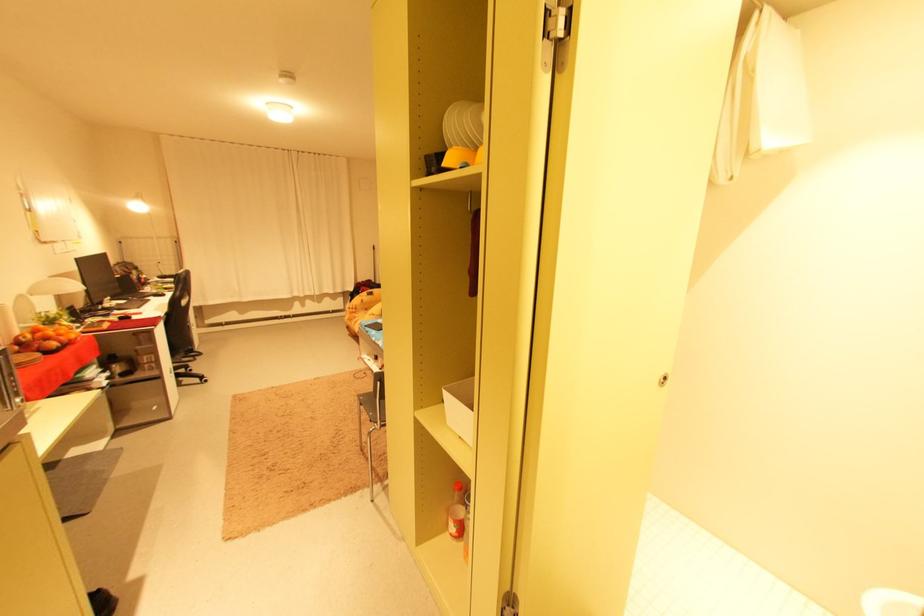
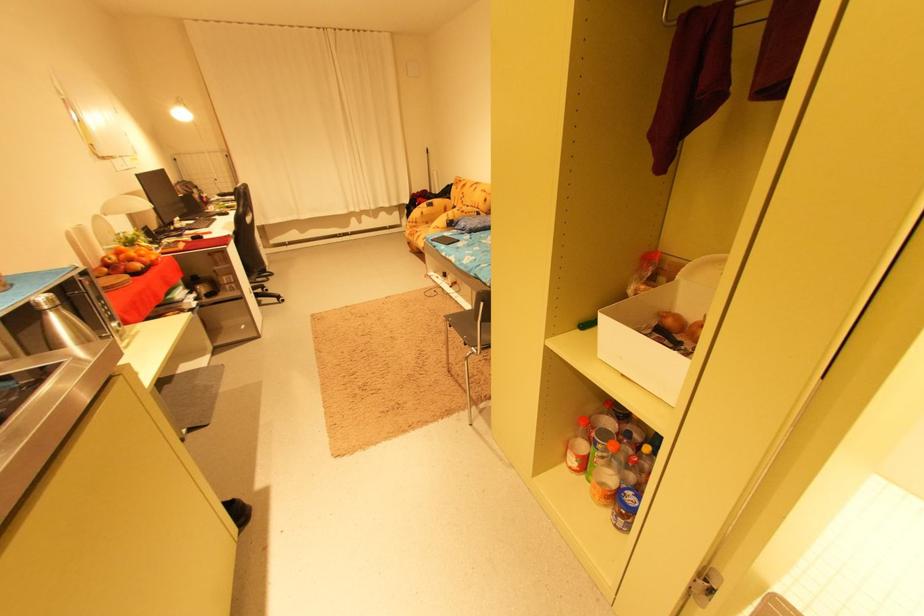
Find the pixel in the second image that matches [68,344] in the first image.

(151, 265)